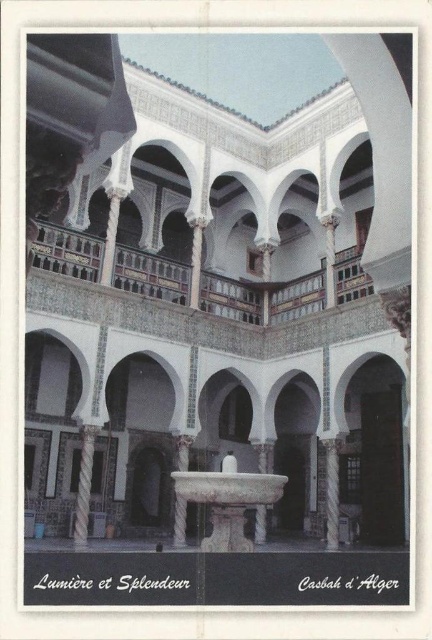
Question: Is white marble pillar at left wider than white marble pillar at center?

Choices:
 (A) no
 (B) yes

Answer: (B)

Question: Estimate the real-world distances between objects in this image. Which object is closer to the white marble fountain at center?

Choices:
 (A) white marble pillar at center
 (B) white marble pillar at left

Answer: (B)

Question: Which object appears closest to the camera in this image?

Choices:
 (A) white marble pillar at left
 (B) white marble pillar at center
 (C) white marble fountain at center

Answer: (C)

Question: Which object is positioned closest to the white marble fountain at center?

Choices:
 (A) white marble pillar at left
 (B) white marble pillar at center

Answer: (A)

Question: In this image, where is white marble fountain at center located relative to white marble pillar at left?

Choices:
 (A) left
 (B) right

Answer: (B)

Question: Can you confirm if white marble fountain at center is positioned to the right of white marble pillar at center?

Choices:
 (A) no
 (B) yes

Answer: (A)